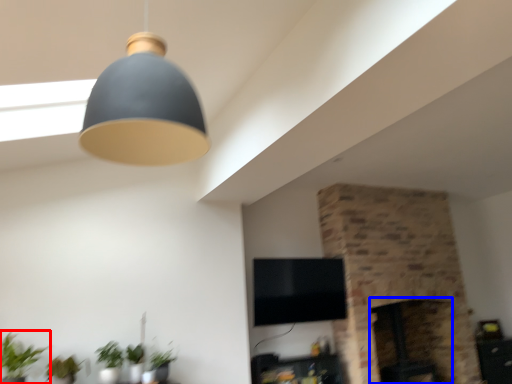
Question: Which object appears farthest to the camera in this image, houseplant (highlighted by a red box) or fireplace (highlighted by a blue box)?

Choices:
 (A) houseplant
 (B) fireplace

Answer: (B)